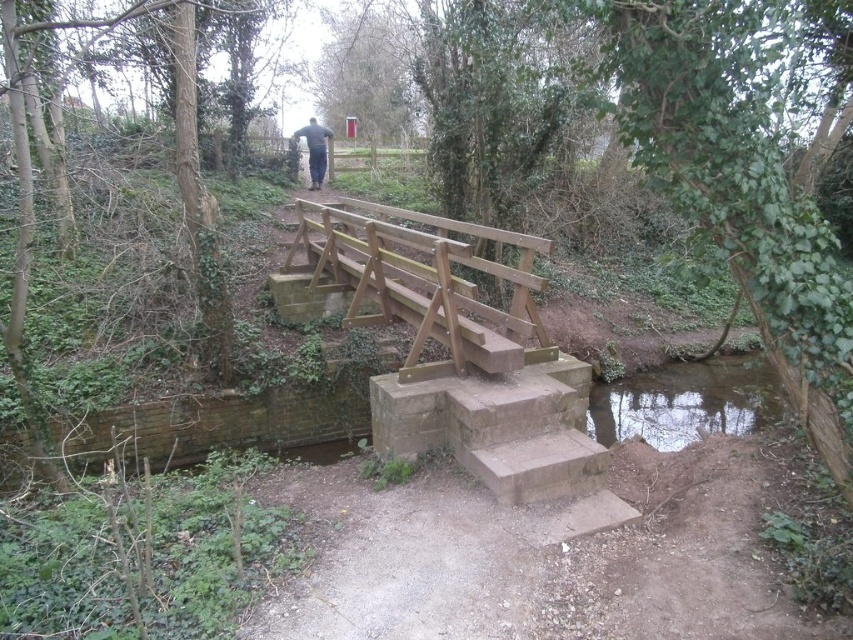
Question: Which point is farther to the camera?

Choices:
 (A) natural wood bridge at center
 (B) clear glassy water at lower right

Answer: (B)

Question: Where is natural wood bridge at center located in relation to clear glassy water at lower right in the image?

Choices:
 (A) above
 (B) below

Answer: (A)

Question: Which object appears closest to the camera in this image?

Choices:
 (A) natural wood bridge at center
 (B) clear glassy water at lower right

Answer: (A)

Question: Observing the image, what is the correct spatial positioning of clear glassy water at lower right in reference to dark blue jeans at center?

Choices:
 (A) above
 (B) below

Answer: (B)

Question: Which point is closer to the camera taking this photo?

Choices:
 (A) (323, 148)
 (B) (699, 422)
 (C) (497, 310)

Answer: (C)

Question: Is natural wood bridge at center further to the viewer compared to clear glassy water at lower right?

Choices:
 (A) yes
 (B) no

Answer: (B)